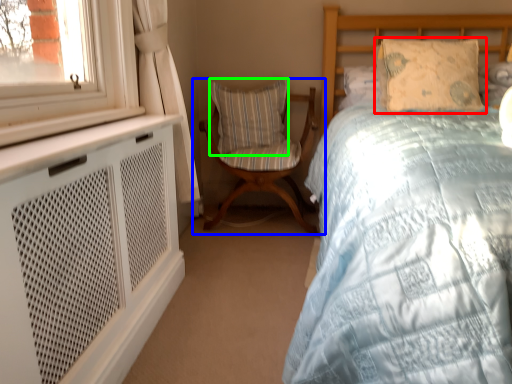
Question: Estimate the real-world distances between objects in this image. Which object is farther from pillow (highlighted by a red box), chair (highlighted by a blue box) or pillow (highlighted by a green box)?

Choices:
 (A) chair
 (B) pillow

Answer: (B)